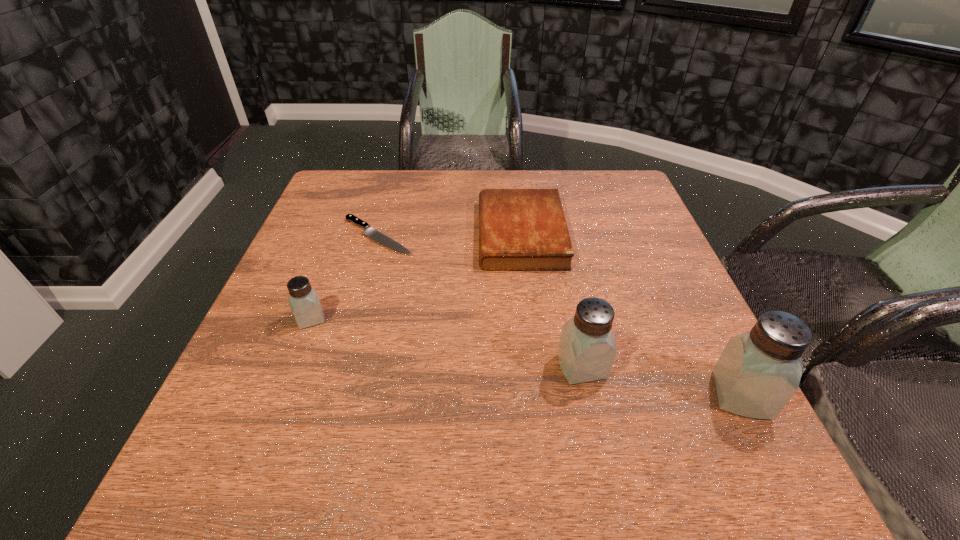
The width and height of the screenshot is (960, 540). In order to click on blank space located 0.300m on the spine side of the Bible in this screenshot , I will do `click(360, 234)`.

Locate an element on the screen. This screenshot has width=960, height=540. blank space located 0.320m on the spine side of the Bible is located at coordinates [x=351, y=234].

Image resolution: width=960 pixels, height=540 pixels. I want to click on free spot located 0.260m on the spine side of the Bible, so click(x=375, y=234).

The width and height of the screenshot is (960, 540). I want to click on vacant space located 0.270m on the right of the shortest object, so click(x=525, y=236).

Find the location of a particular element. The image size is (960, 540). object at the far edge is located at coordinates (519, 229).

Locate an element on the screen. Image resolution: width=960 pixels, height=540 pixels. saltshaker positioned at the left edge is located at coordinates (304, 302).

Where is `steak knife that is at the left edge`? This screenshot has height=540, width=960. steak knife that is at the left edge is located at coordinates (374, 234).

I want to click on object present at the right edge, so click(758, 372).

Locate an element on the screen. object at the near right corner is located at coordinates (758, 372).

Where is `vacant area at the far edge of the desktop`? This screenshot has height=540, width=960. vacant area at the far edge of the desktop is located at coordinates (406, 183).